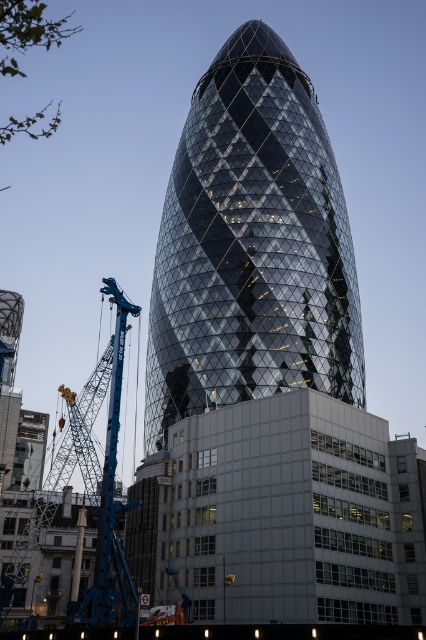
Which is in front, point (158, 301) or point (17, 332)?

Positioned in front is point (158, 301).

From the picture: Does glassy steel tower at center appear on the left side of blue metallic crane at left?

No, glassy steel tower at center is not to the left of blue metallic crane at left.

You are a GUI agent. You are given a task and a screenshot of the screen. Output one action in this format:
    pyautogui.click(x=<x>, y=<y>)
    Task: Click on the glassy steel tower at center
    The image size is (426, 640).
    Given the screenshot: What is the action you would take?
    pyautogui.click(x=252, y=246)

Locate an element on the screen. Image resolution: width=426 pixels, height=640 pixels. glassy steel tower at center is located at coordinates (252, 246).